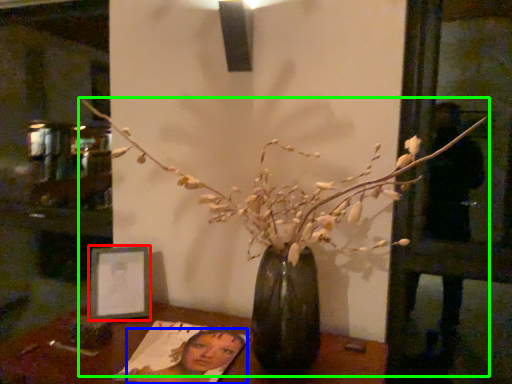
Question: Estimate the real-world distances between objects in this image. Which object is closer to picture frame (highlighted by a red box), woman (highlighted by a blue box) or houseplant (highlighted by a green box)?

Choices:
 (A) woman
 (B) houseplant

Answer: (A)